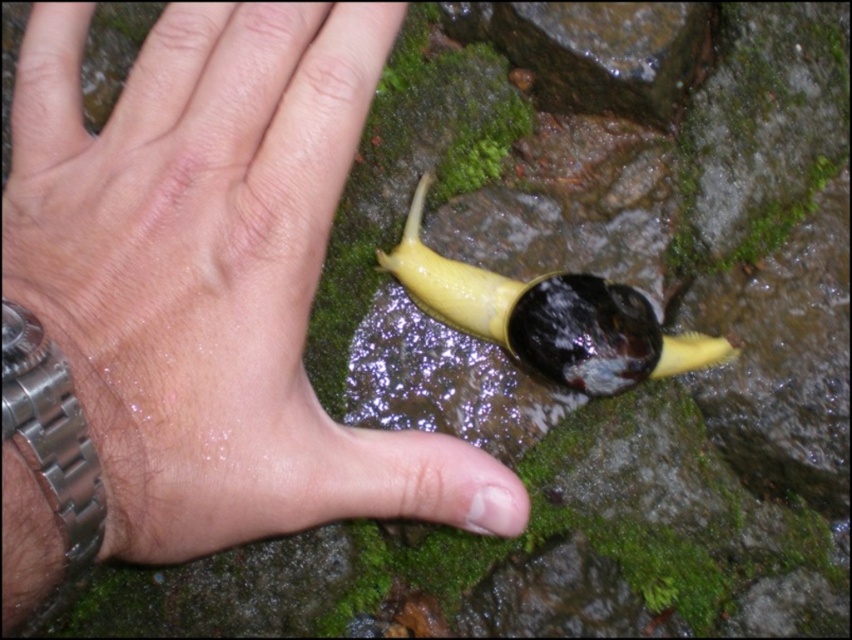
Question: Which object is closer to the camera taking this photo?

Choices:
 (A) yellow rubber snail at center
 (B) skinny silver watch at lower left

Answer: (B)

Question: Is skinny silver watch at lower left below yellow rubber snail at center?

Choices:
 (A) yes
 (B) no

Answer: (B)

Question: Observing the image, what is the correct spatial positioning of skinny silver watch at lower left in reference to yellow rubber snail at center?

Choices:
 (A) above
 (B) below

Answer: (A)

Question: Does skinny silver watch at lower left come in front of yellow rubber snail at center?

Choices:
 (A) no
 (B) yes

Answer: (B)